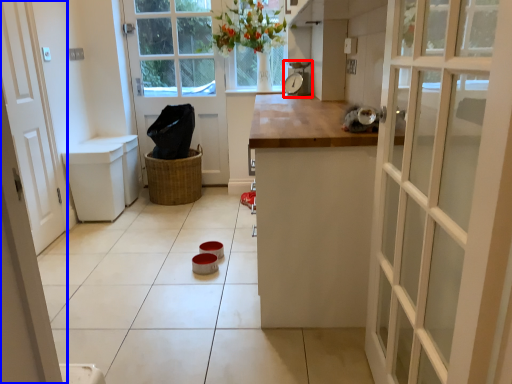
Question: Which object is further to the camera taking this photo, appliance (highlighted by a red box) or door (highlighted by a blue box)?

Choices:
 (A) appliance
 (B) door

Answer: (A)